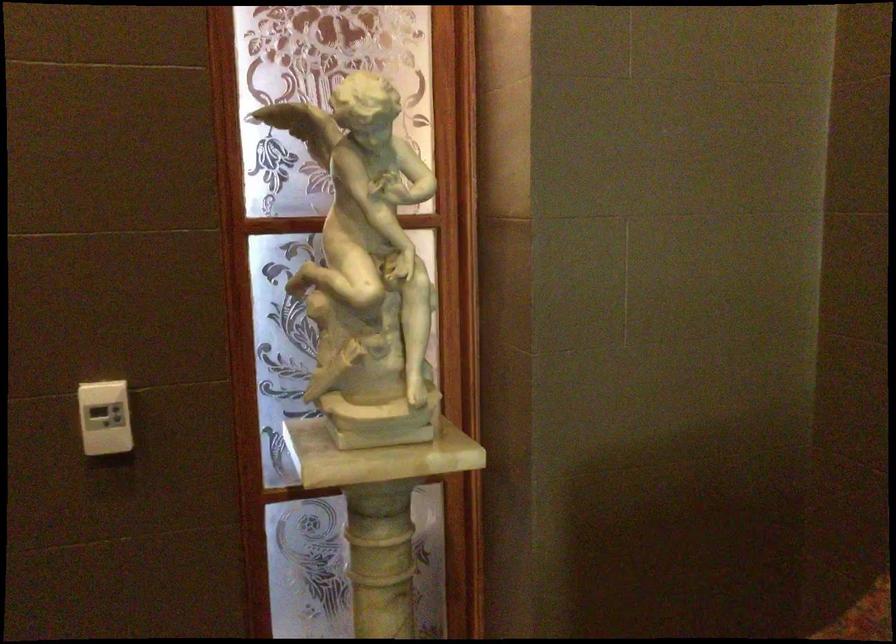
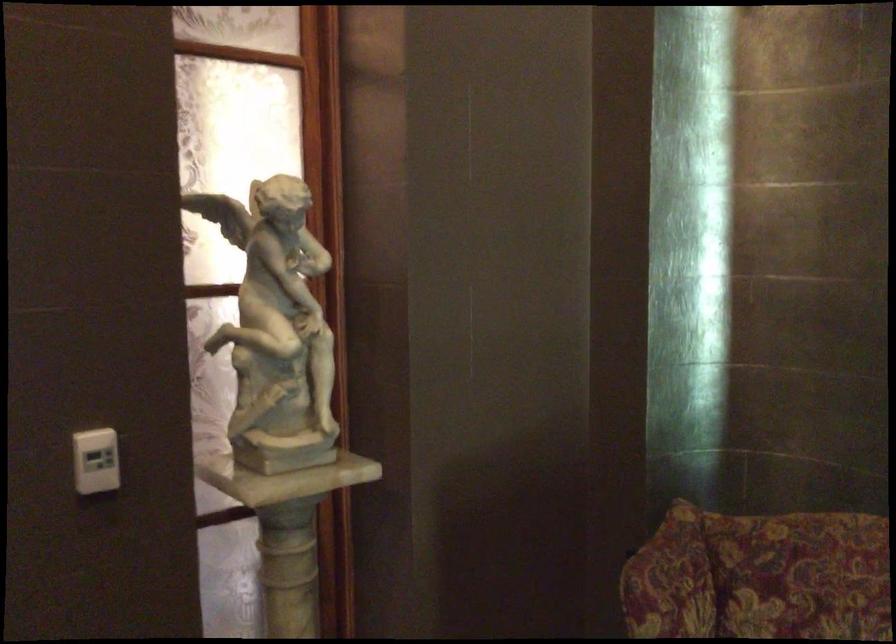
Locate, in the second image, the point that corresponds to point 109,419 in the first image.

(95, 460)